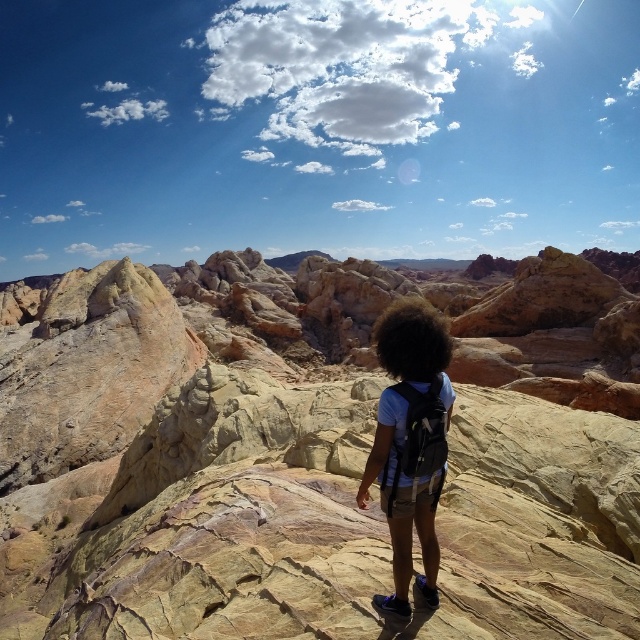
Question: Is smooth sandstone rock at center below dark curly hair at center?

Choices:
 (A) yes
 (B) no

Answer: (B)

Question: Which point appears closest to the camera in this image?

Choices:
 (A) (64, 612)
 (B) (384, 452)
 (C) (435, 339)

Answer: (B)

Question: Is smooth sandstone rock at center wider than matte black backpack at center?

Choices:
 (A) yes
 (B) no

Answer: (A)

Question: Which object is positioned closest to the dark curly hair at center?

Choices:
 (A) smooth sandstone rock at center
 (B) matte black backpack at center

Answer: (B)

Question: Which point is farther to the camera?

Choices:
 (A) smooth sandstone rock at center
 (B) matte black backpack at center
 (C) dark curly hair at center

Answer: (C)

Question: Where is matte black backpack at center located in relation to dark curly hair at center in the image?

Choices:
 (A) right
 (B) left

Answer: (B)